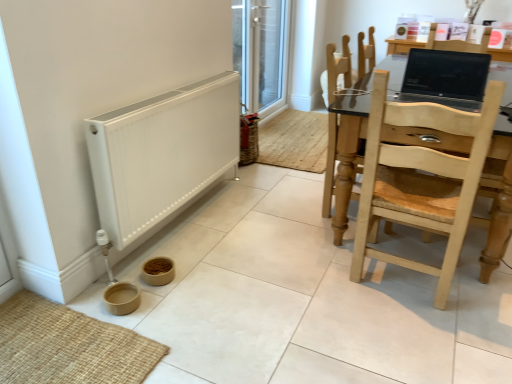
Locate an element on the screen. free location in front of white matte heater at lower left is located at coordinates (195, 300).